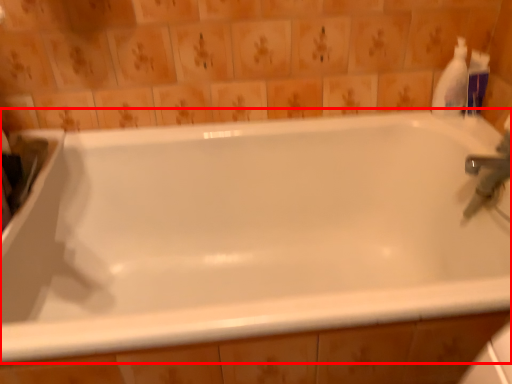
Question: Observing the image, what is the correct spatial positioning of bathtub (annotated by the red box) in reference to cleaning product?

Choices:
 (A) right
 (B) left

Answer: (B)